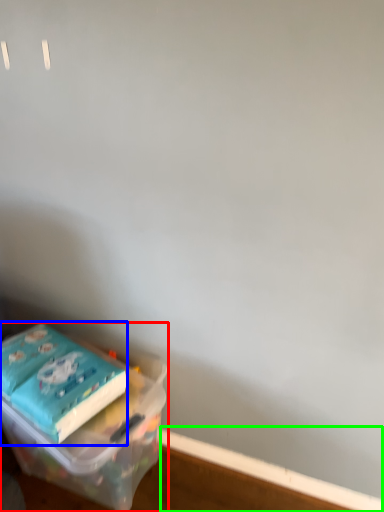
Question: Which is nearer to the box (highlighted by a red box)? paperback book (highlighted by a blue box) or window sill (highlighted by a green box).

Choices:
 (A) paperback book
 (B) window sill

Answer: (A)